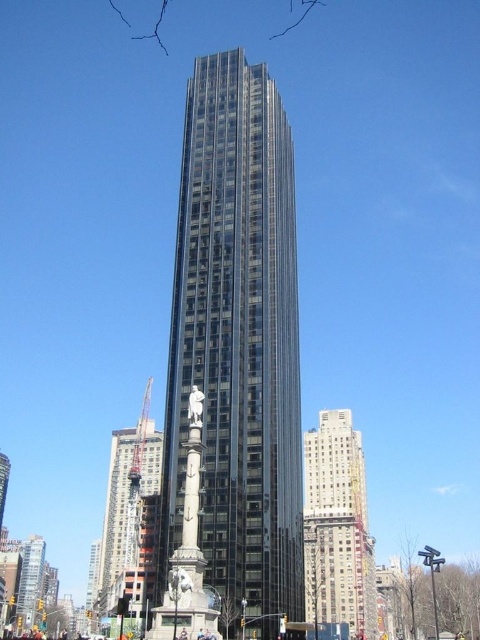
You are standing at the center of the city square and want to take a photo of the shiny glass tower at center. If the camera can only focus on objects within a 0.5 radius from the center point, will the tower be in focus?

The shiny glass tower at center is positioned at point (238,346), which is within the 0.5 radius from the center point. Therefore, the tower will be in focus.

You are a city planner assessing the skyline. You need to determine which of the two buildings, the shiny glass tower at center or the metallic glass construction at center, would cast a longer shadow at noon. Based on their heights, which one would cast a longer shadow?

The shiny glass tower at center is taller than the metallic glass construction at center, so it would cast a longer shadow at noon.